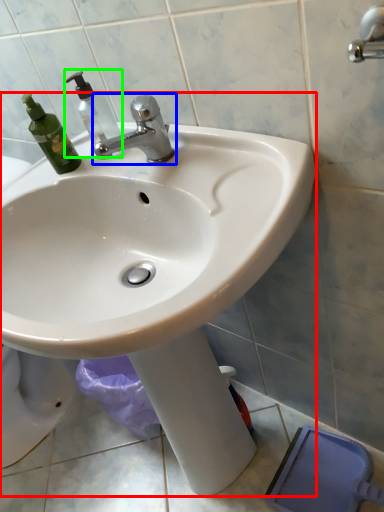
Question: Based on their relative distances, which object is nearer to sink (highlighted by a red box)? Choose from tap (highlighted by a blue box) and soap dispenser (highlighted by a green box).

Choices:
 (A) tap
 (B) soap dispenser

Answer: (A)